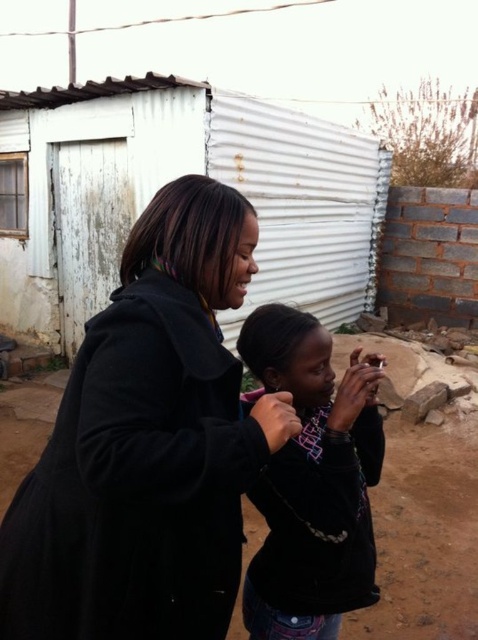
You are a photographer trying to capture a portrait of both the black fleece jacket at center and the dark blue fleece jacket at center in the image. Since you want both jackets to be clearly visible in the photo, which jacket should you focus on first to ensure the background is properly blurred?

The black fleece jacket at center is in front of the dark blue fleece jacket at center. To blur the background and keep both jackets in focus, you should focus on the dark blue fleece jacket at center, as it is farther back, ensuring the foreground and background are sharp.

You are planning to build a small garden in the dirt field at lower center. Considering the size of the white corrugated metal hut at center, do you think there is enough space for a garden plot that is half the size of the hut?

The white corrugated metal hut at center is bigger than the dirt field at lower center. Since the garden plot requires half the size of the hut, it would be larger than the available dirt field. Therefore, there isn not enough space for the garden plot.

You are standing at the point with coordinates point (345, 577) and want to walk towards the point with coordinates point (460, 460). Which direction should you face to move directly towards it?

Since point (345, 577) is in front of point (460, 460), you should face backward to move directly towards point (460, 460).